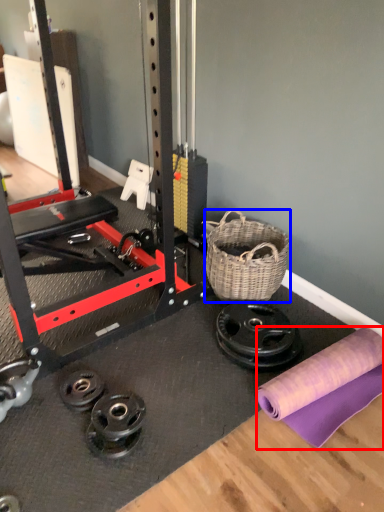
Question: Which point is further to the camera, fabric (highlighted by a red box) or basket (highlighted by a blue box)?

Choices:
 (A) fabric
 (B) basket

Answer: (B)